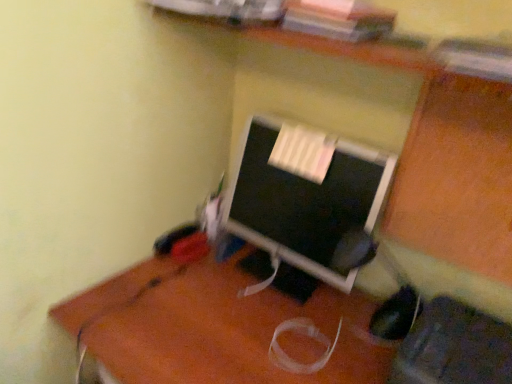
This screenshot has height=384, width=512. What are the coordinates of `vacant space in front of matte black monitor at center` in the screenshot? It's located at (249, 321).